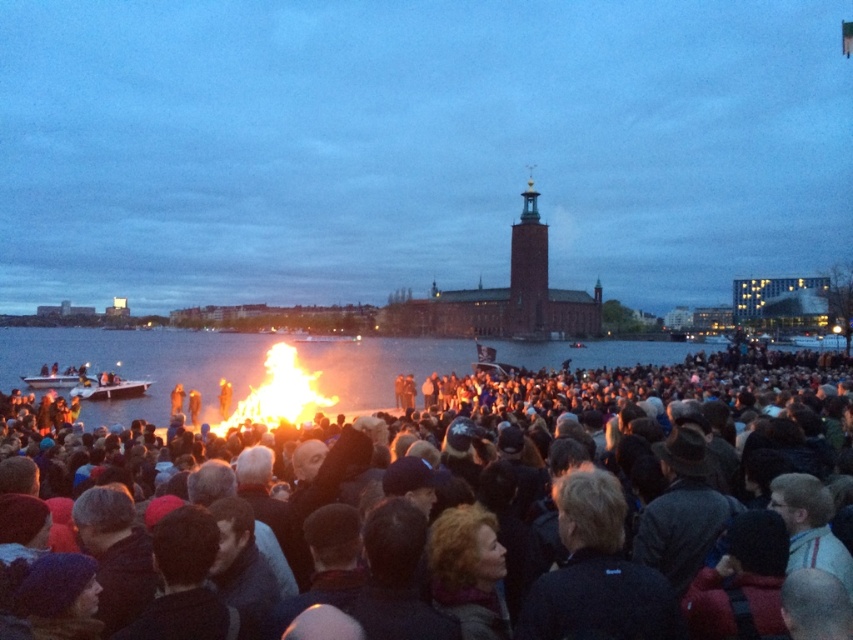
Question: Which of the following is the closest to the observer?

Choices:
 (A) (264, 353)
 (B) (381, 483)
 (C) (277, 404)
 (D) (314, 26)

Answer: (B)

Question: Does dark clothing crowd at center appear over flaming wood at center?

Choices:
 (A) yes
 (B) no

Answer: (B)

Question: Is dark clothing crowd at center closer to the viewer compared to transparent water at center?

Choices:
 (A) no
 (B) yes

Answer: (B)

Question: Which object appears farthest from the camera in this image?

Choices:
 (A) flaming wood at center
 (B) transparent water at center

Answer: (B)

Question: Considering the real-world distances, which object is farthest from the brick building at center?

Choices:
 (A) dark clothing crowd at center
 (B) transparent water at center
 (C) flaming wood at center

Answer: (A)

Question: In this image, where is brick building at center located relative to dark clothing crowd at center?

Choices:
 (A) right
 (B) left

Answer: (B)